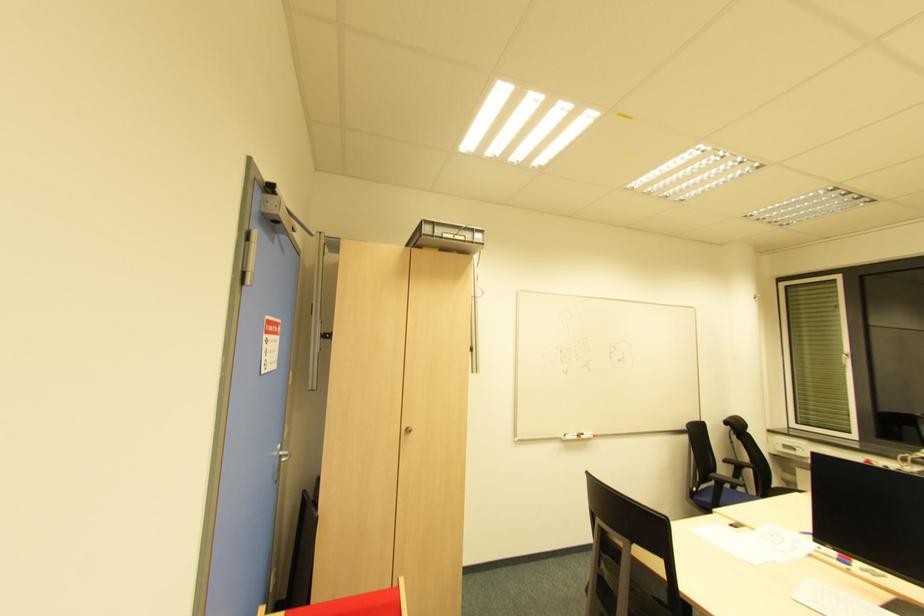
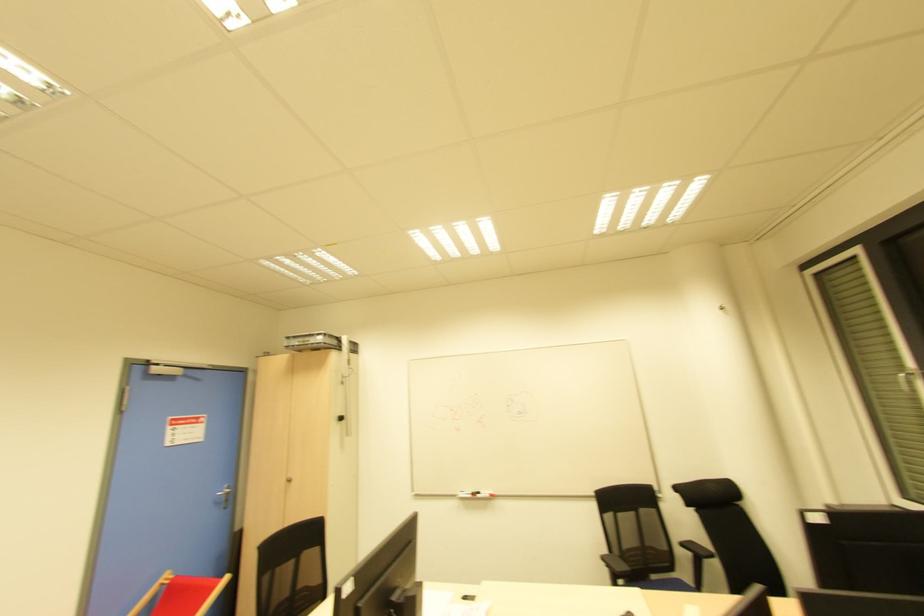
Locate, in the second image, the point that corresponds to (725,464) in the first image.

(681, 545)